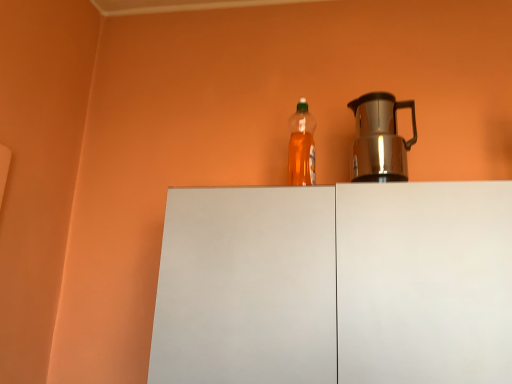
Question: Is shiny metallic kettle at right closer to the viewer compared to translucent plastic bottle at center?

Choices:
 (A) yes
 (B) no

Answer: (A)

Question: Considering the relative positions of shiny metallic kettle at right and translucent plastic bottle at center in the image provided, is shiny metallic kettle at right to the right of translucent plastic bottle at center from the viewer's perspective?

Choices:
 (A) yes
 (B) no

Answer: (A)

Question: From the image's perspective, is shiny metallic kettle at right over translucent plastic bottle at center?

Choices:
 (A) no
 (B) yes

Answer: (A)

Question: Is shiny metallic kettle at right facing away from translucent plastic bottle at center?

Choices:
 (A) yes
 (B) no

Answer: (B)

Question: Considering the relative sizes of shiny metallic kettle at right and translucent plastic bottle at center in the image provided, is shiny metallic kettle at right shorter than translucent plastic bottle at center?

Choices:
 (A) yes
 (B) no

Answer: (A)

Question: From the image's perspective, is shiny metallic kettle at right above or below white matte cabinet at center?

Choices:
 (A) below
 (B) above

Answer: (B)

Question: Considering their positions, is shiny metallic kettle at right located in front of or behind white matte cabinet at center?

Choices:
 (A) behind
 (B) front

Answer: (A)

Question: In terms of width, does shiny metallic kettle at right look wider or thinner when compared to white matte cabinet at center?

Choices:
 (A) wide
 (B) thin

Answer: (B)

Question: Is shiny metallic kettle at right taller or shorter than white matte cabinet at center?

Choices:
 (A) tall
 (B) short

Answer: (B)

Question: Considering the positions of translucent plastic bottle at center and white matte cabinet at center in the image, is translucent plastic bottle at center bigger or smaller than white matte cabinet at center?

Choices:
 (A) big
 (B) small

Answer: (B)

Question: Does point (296, 119) appear closer or farther from the camera than point (381, 244)?

Choices:
 (A) closer
 (B) farther

Answer: (B)

Question: Considering the positions of translucent plastic bottle at center and white matte cabinet at center in the image, is translucent plastic bottle at center wider or thinner than white matte cabinet at center?

Choices:
 (A) wide
 (B) thin

Answer: (B)

Question: In terms of height, does translucent plastic bottle at center look taller or shorter compared to white matte cabinet at center?

Choices:
 (A) short
 (B) tall

Answer: (A)

Question: Looking at their shapes, would you say white matte cabinet at center is wider or thinner than shiny metallic kettle at right?

Choices:
 (A) wide
 (B) thin

Answer: (A)

Question: Is white matte cabinet at center inside or outside of shiny metallic kettle at right?

Choices:
 (A) inside
 (B) outside

Answer: (B)